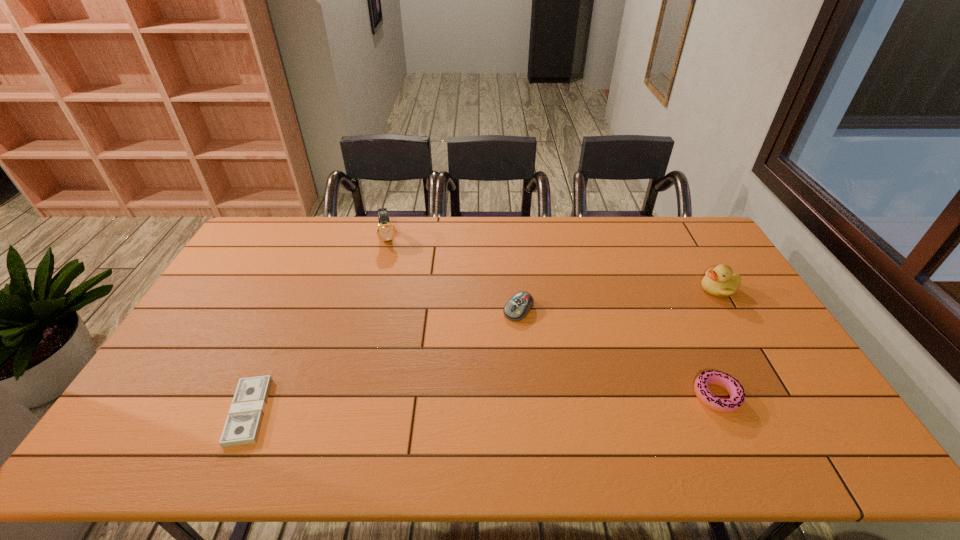
Identify the location of vacant region located on the beak of the rightmost object. This screenshot has height=540, width=960. (684, 312).

What are the coordinates of `vacant region located on the beak of the rightmost object` in the screenshot? It's located at (653, 333).

You are a GUI agent. You are given a task and a screenshot of the screen. Output one action in this format:
    pyautogui.click(x=<x>, y=<y>)
    Task: Click on the free space located on the beak of the rightmost object
    
    Given the screenshot: What is the action you would take?
    pyautogui.click(x=683, y=313)

The width and height of the screenshot is (960, 540). I want to click on vacant space located 0.180m on the wheel side of the computer mouse, so click(x=478, y=360).

Locate an element on the screen. The height and width of the screenshot is (540, 960). vacant position located on the wheel side of the computer mouse is located at coordinates (474, 364).

Identify the location of blank area located 0.340m on the wheel side of the computer mouse. Image resolution: width=960 pixels, height=540 pixels. (444, 402).

Find the location of a particular element. free space located 0.350m on the face of the fourth object from right to left is located at coordinates (402, 314).

Image resolution: width=960 pixels, height=540 pixels. I want to click on free spot located on the face of the fourth object from right to left, so click(397, 291).

I want to click on vacant point located 0.230m on the face of the fourth object from right to left, so click(397, 289).

The image size is (960, 540). Identify the location of object located in the far edge section of the desktop. (385, 231).